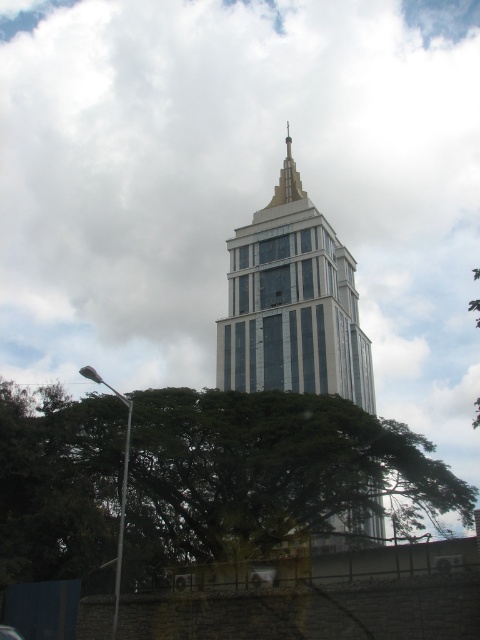
Question: Can you confirm if metallic glass tower at center is positioned below shiny gold spire at center?

Choices:
 (A) no
 (B) yes

Answer: (B)

Question: Which object is positioned farthest from the metallic glass tower at center?

Choices:
 (A) shiny gold spire at center
 (B) green leafy tree at lower left
 (C) white fluffy cloud at upper center

Answer: (C)

Question: Which point appears closest to the camera in this image?

Choices:
 (A) (265, 205)
 (B) (202, 300)
 (C) (308, 388)

Answer: (C)

Question: Which point appears closest to the camera in this image?

Choices:
 (A) (22, 406)
 (B) (356, 342)
 (C) (436, 435)

Answer: (A)

Question: Is white fluffy cloud at upper center positioned before metallic glass tower at center?

Choices:
 (A) no
 (B) yes

Answer: (A)

Question: Is green leafy tree at lower left to the left of shiny gold spire at center from the viewer's perspective?

Choices:
 (A) no
 (B) yes

Answer: (B)